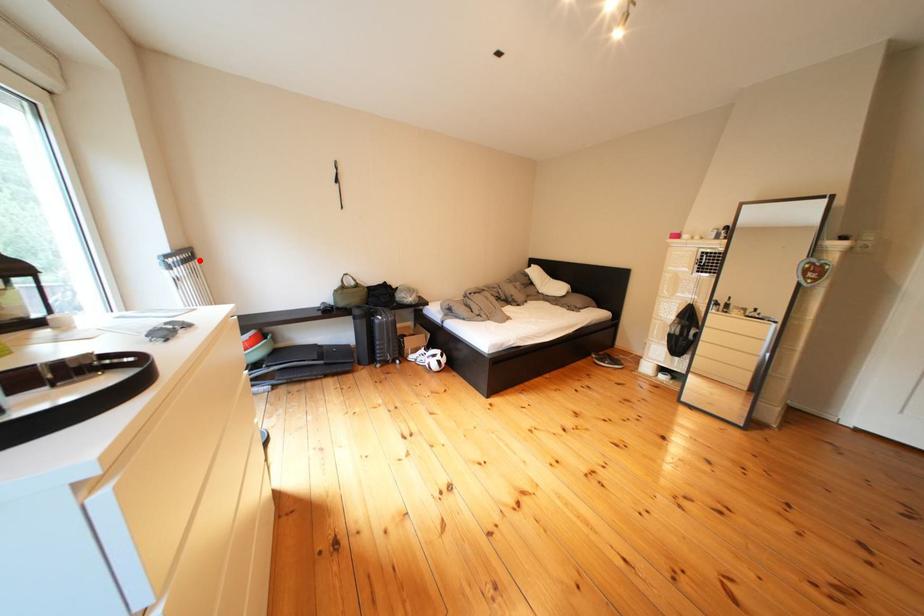
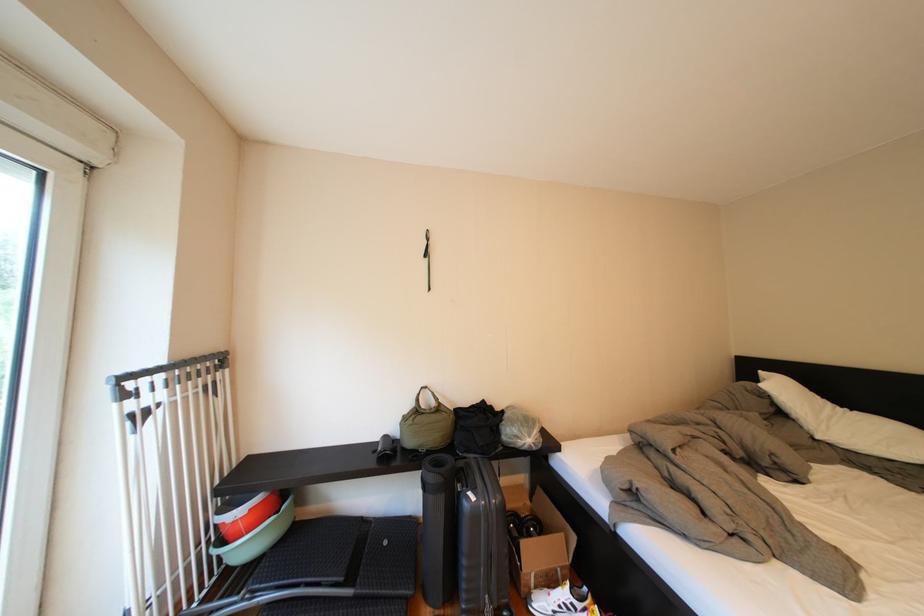
In the second image, find the point that corresponds to the highlighted location in the first image.

(224, 369)